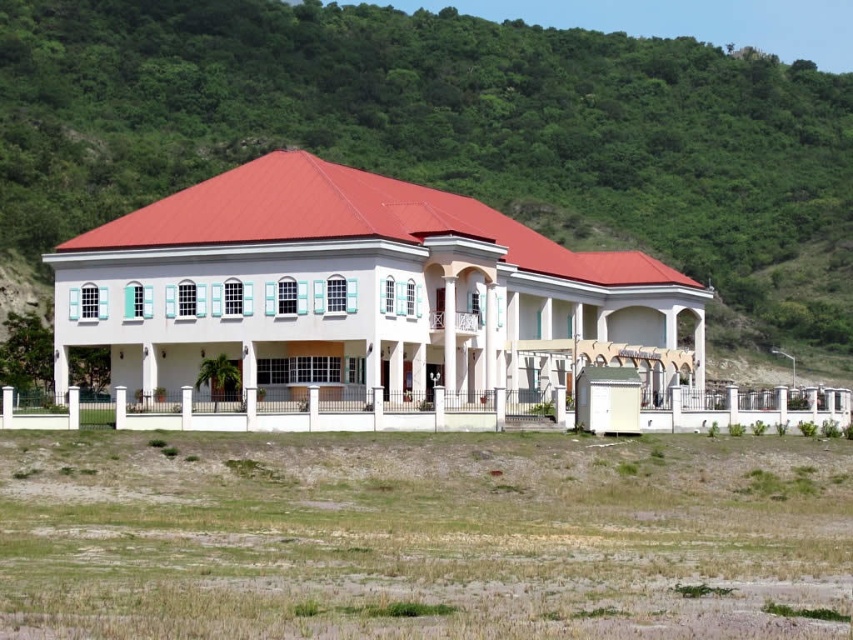
Does green leafy hillside at upper center have a smaller size compared to white glossy gazebo at center?

No.

Which is below, green leafy hillside at upper center or white glossy gazebo at center?

Positioned lower is white glossy gazebo at center.

Between point (747, 88) and point (332, 259), which one is positioned in front?

Point (332, 259) is in front.

Identify the location of green leafy hillside at upper center. (451, 134).